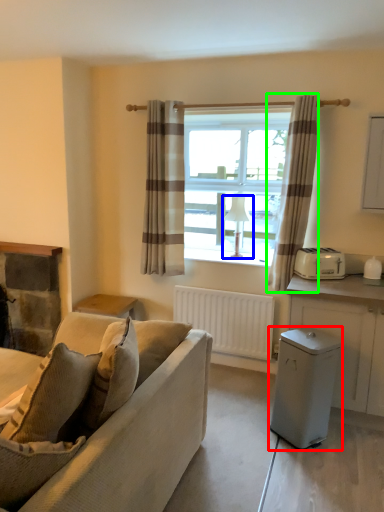
Question: Which object is the farthest from appliance (highlighted by a red box)? Choose among these: lamp (highlighted by a blue box) or curtain (highlighted by a green box).

Choices:
 (A) lamp
 (B) curtain

Answer: (A)